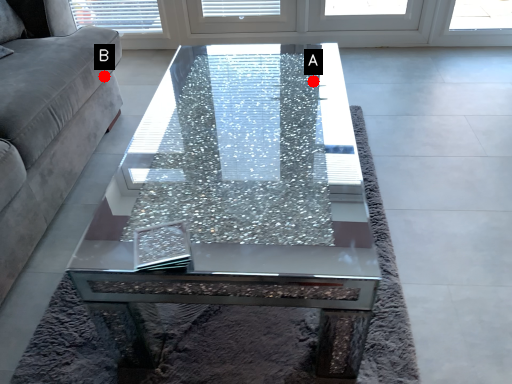
Question: Two points are circled on the image, labeled by A and B beside each circle. Which point is closer to the camera taking this photo?

Choices:
 (A) A is closer
 (B) B is closer

Answer: (A)